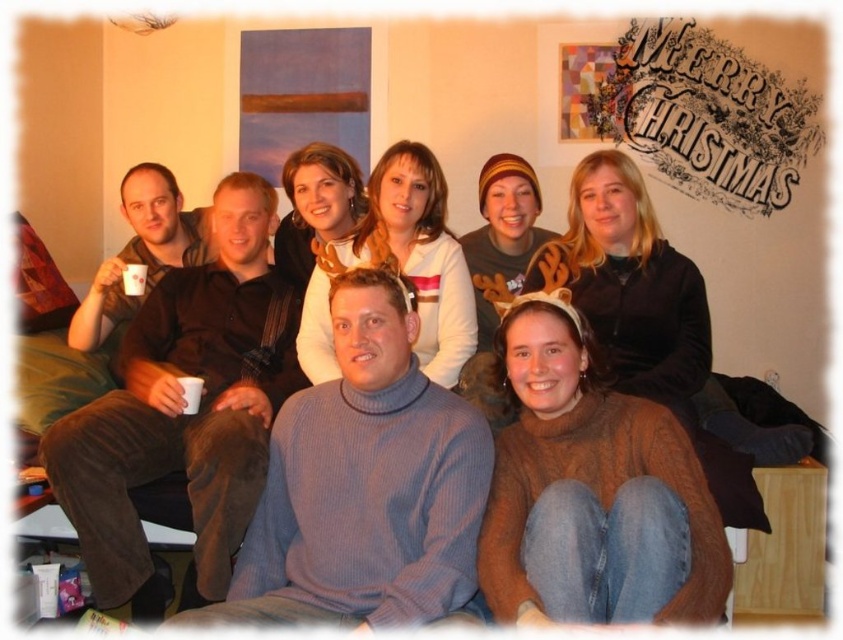
You are standing in the room and see two points marked on the wall. The first point is at coordinates point (656, 598) and the second is at point (679, 296). Which point is closer to you?

Point (656, 598) is in front of point (679, 296), so it is closer to you.